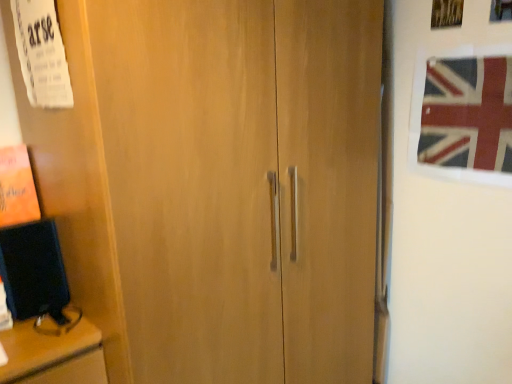
Question: Is white paper at upper left bigger or smaller than union jack fabric at upper right?

Choices:
 (A) big
 (B) small

Answer: (A)

Question: Relative to union jack fabric at upper right, is white paper at upper left in front or behind?

Choices:
 (A) front
 (B) behind

Answer: (A)

Question: From the image's perspective, is white paper at upper left located above or below union jack fabric at upper right?

Choices:
 (A) above
 (B) below

Answer: (A)

Question: In terms of height, does union jack fabric at upper right look taller or shorter compared to white paper at upper left?

Choices:
 (A) tall
 (B) short

Answer: (B)

Question: Is union jack fabric at upper right bigger or smaller than white paper at upper left?

Choices:
 (A) big
 (B) small

Answer: (B)

Question: Is union jack fabric at upper right wider or thinner than white paper at upper left?

Choices:
 (A) thin
 (B) wide

Answer: (A)

Question: Visually, is union jack fabric at upper right positioned to the left or to the right of white paper at upper left?

Choices:
 (A) right
 (B) left

Answer: (A)